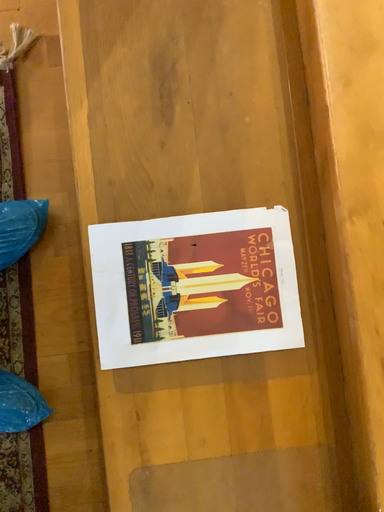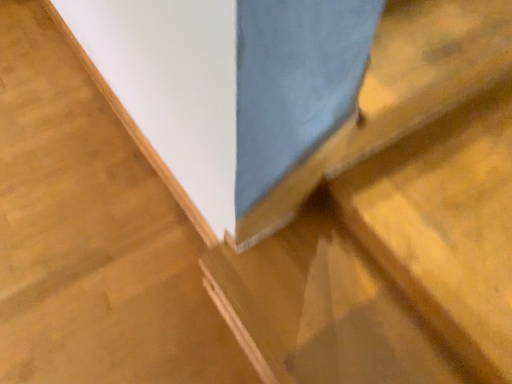
Question: Which way did the camera rotate in the video?

Choices:
 (A) rotated upward
 (B) rotated downward

Answer: (A)